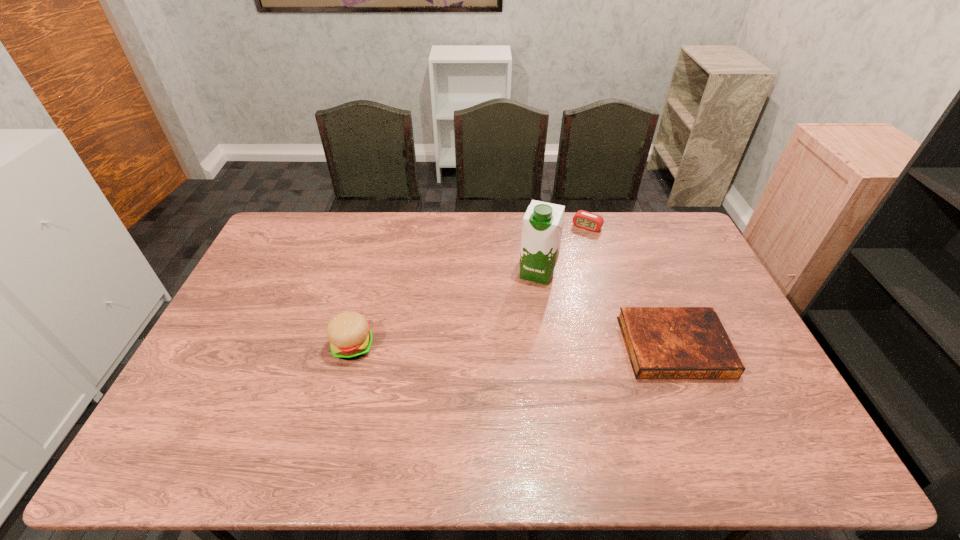
Find the location of a particular element. Image resolution: width=960 pixels, height=540 pixels. the third closest object to the Bible is located at coordinates (349, 333).

Identify which object is the nearest to the Bible. Please provide its 2D coordinates. Your answer should be formatted as a tuple, i.e. [(x, y)], where the tuple contains the x and y coordinates of a point satisfying the conditions above.

[(543, 222)]

Where is `vacant region that satisfies the following two spatial constraints: 1. on the back side of the alarm clock; 2. on the right side of the hamburger`? vacant region that satisfies the following two spatial constraints: 1. on the back side of the alarm clock; 2. on the right side of the hamburger is located at coordinates (385, 227).

Locate an element on the screen. The width and height of the screenshot is (960, 540). vacant area that satisfies the following two spatial constraints: 1. on the back side of the third shortest object; 2. on the left side of the farthest object is located at coordinates (385, 227).

Where is `vacant space that satisfies the following two spatial constraints: 1. on the back side of the soya milk; 2. on the left side of the farthest object`? The width and height of the screenshot is (960, 540). vacant space that satisfies the following two spatial constraints: 1. on the back side of the soya milk; 2. on the left side of the farthest object is located at coordinates (531, 227).

Identify the location of vacant area that satisfies the following two spatial constraints: 1. on the back side of the soya milk; 2. on the left side of the alarm clock. (531, 227).

Where is `vacant area that satisfies the following two spatial constraints: 1. on the back side of the hamburger; 2. on the right side of the third object from right to left`? This screenshot has width=960, height=540. vacant area that satisfies the following two spatial constraints: 1. on the back side of the hamburger; 2. on the right side of the third object from right to left is located at coordinates (372, 273).